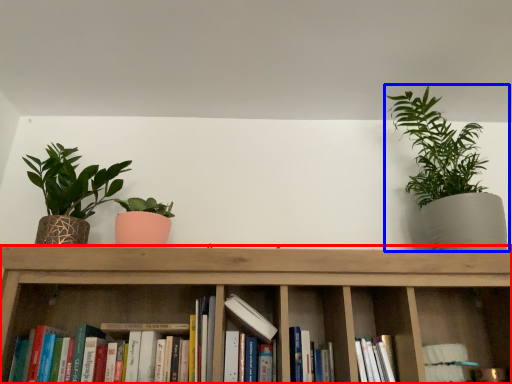
Question: Which point is further to the camera, shelf (highlighted by a red box) or houseplant (highlighted by a blue box)?

Choices:
 (A) shelf
 (B) houseplant

Answer: (B)